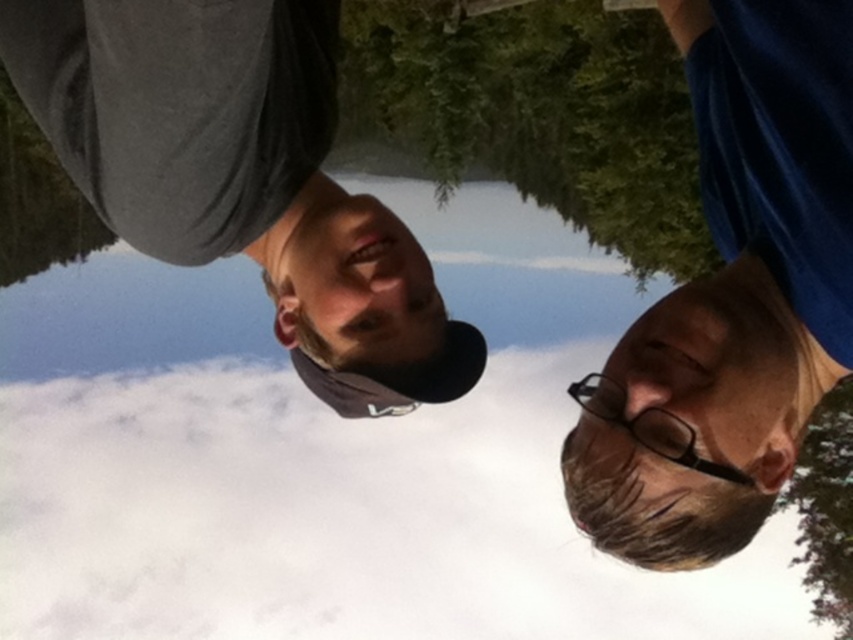
You are a photographer trying to capture a closeup of the black plastic glasses at lower right without the blue fabric at right blocking the view. Is it possible to do so without moving any objects?

The blue fabric at right is in front of the black plastic glasses at lower right, so it would block the view. To capture a clear image, you would need to adjust the angle or remove the blue fabric at right.

You are a photographer analyzing the composition of the image. The matte gray cap at upper left is part of a rule of thirds grid. Is it closer to the top or bottom third of the image?

The matte gray cap at upper left is positioned at point coordinates of 0.284 on the vertical axis. Since the rule of thirds divides the image into three equal parts vertically, the bottom third would be up to 0.333. Therefore, the matte gray cap at upper left is closer to the bottom third of the image.